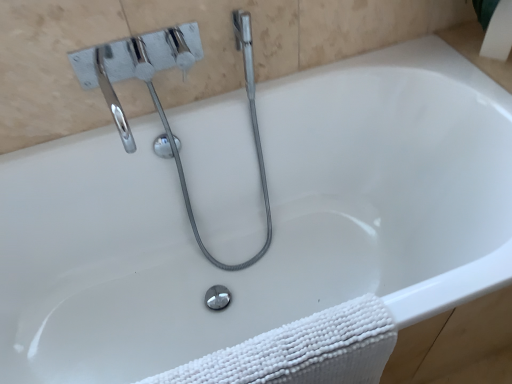
Question: From a real-world perspective, does white textured towel at lower right stand above chrome/metallic faucet at upper left?

Choices:
 (A) no
 (B) yes

Answer: (A)

Question: Would you say white textured towel at lower right contains chrome/metallic faucet at upper left?

Choices:
 (A) no
 (B) yes

Answer: (A)

Question: Considering the relative sizes of white textured towel at lower right and chrome/metallic faucet at upper left in the image provided, is white textured towel at lower right wider than chrome/metallic faucet at upper left?

Choices:
 (A) no
 (B) yes

Answer: (A)

Question: Is white textured towel at lower right to the left of chrome/metallic faucet at upper left from the viewer's perspective?

Choices:
 (A) no
 (B) yes

Answer: (A)

Question: Is white textured towel at lower right in front of chrome/metallic faucet at upper left?

Choices:
 (A) yes
 (B) no

Answer: (A)

Question: From the image's perspective, is white textured towel at lower right located above chrome/metallic faucet at upper left?

Choices:
 (A) yes
 (B) no

Answer: (B)

Question: Is chrome/metallic faucet at upper left to the left of white textured towel at lower right from the viewer's perspective?

Choices:
 (A) no
 (B) yes

Answer: (B)

Question: Is chrome/metallic faucet at upper left in front of white textured towel at lower right?

Choices:
 (A) yes
 (B) no

Answer: (B)

Question: Is chrome/metallic faucet at upper left not within white textured towel at lower right?

Choices:
 (A) no
 (B) yes

Answer: (B)

Question: From the image's perspective, is chrome/metallic faucet at upper left above white textured towel at lower right?

Choices:
 (A) yes
 (B) no

Answer: (A)

Question: Is chrome/metallic faucet at upper left positioned behind white textured towel at lower right?

Choices:
 (A) no
 (B) yes

Answer: (B)

Question: Is chrome/metallic faucet at upper left taller than white textured towel at lower right?

Choices:
 (A) no
 (B) yes

Answer: (B)

Question: From the image's perspective, is white textured towel at lower right above or below chrome/metallic faucet at upper left?

Choices:
 (A) below
 (B) above

Answer: (A)